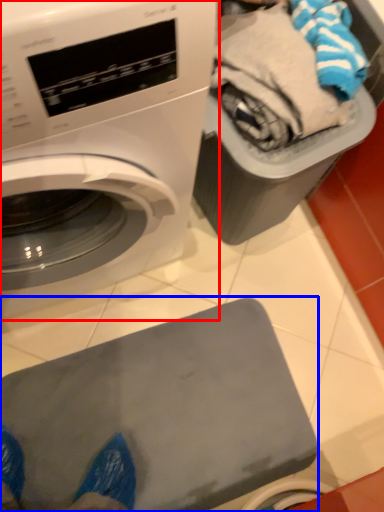
Question: Which object appears farthest to the camera in this image, washing machine (highlighted by a red box) or appliance (highlighted by a blue box)?

Choices:
 (A) washing machine
 (B) appliance

Answer: (B)